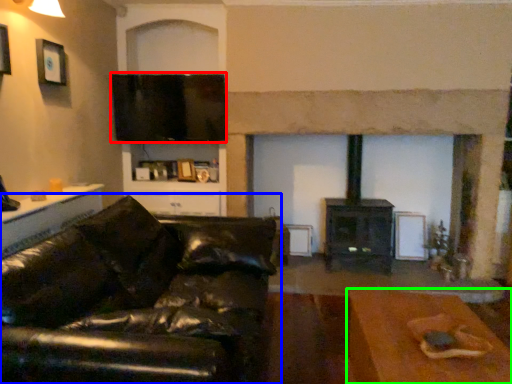
Question: Which object is positioned farthest from window screen (highlighted by a red box)? Select from studio couch (highlighted by a blue box) and table (highlighted by a green box).

Choices:
 (A) studio couch
 (B) table

Answer: (B)